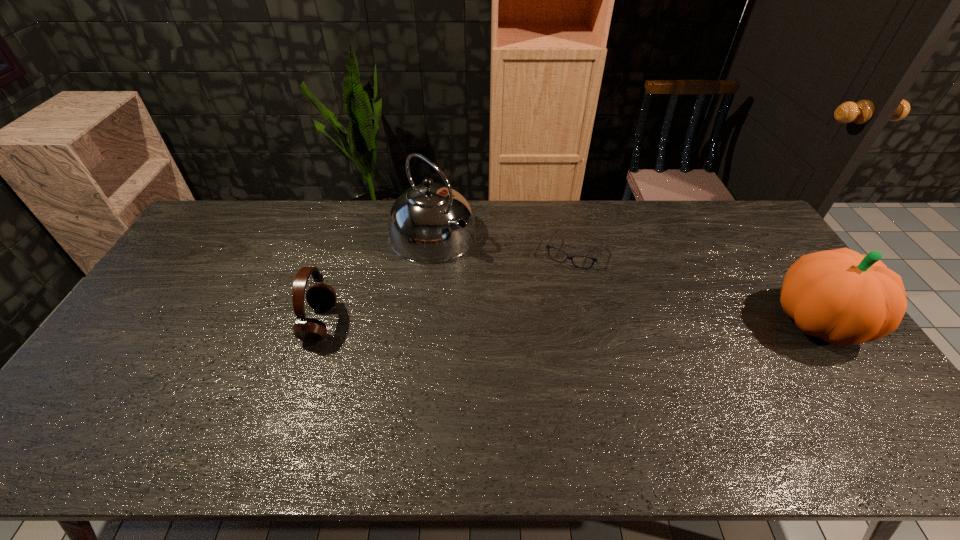
In the image, there is a desktop. Where is `vacant space at the right edge`? vacant space at the right edge is located at coordinates (783, 262).

The image size is (960, 540). In order to click on vacant space at the far left corner in this screenshot , I will do tap(216, 233).

Identify the location of free space between the kettle and the pumpkin. tap(625, 278).

Where is `empty space between the rightmost object and the leftmost object`? The image size is (960, 540). empty space between the rightmost object and the leftmost object is located at coordinates point(569,322).

This screenshot has width=960, height=540. Find the location of `empty space between the second object from right to left and the kettle`. empty space between the second object from right to left and the kettle is located at coordinates (503, 244).

The width and height of the screenshot is (960, 540). In order to click on vacant space in between the rightmost object and the kettle in this screenshot , I will do `click(625, 278)`.

What are the coordinates of `free point between the pumpkin and the headset` in the screenshot? It's located at (569, 322).

This screenshot has height=540, width=960. Find the location of `free space between the rightmost object and the kettle`. free space between the rightmost object and the kettle is located at coordinates (625, 278).

Where is `unoccupied area between the kettle and the leftmost object`? Image resolution: width=960 pixels, height=540 pixels. unoccupied area between the kettle and the leftmost object is located at coordinates (376, 279).

What are the coordinates of `vacant space in between the second object from right to left and the headset` in the screenshot? It's located at (446, 288).